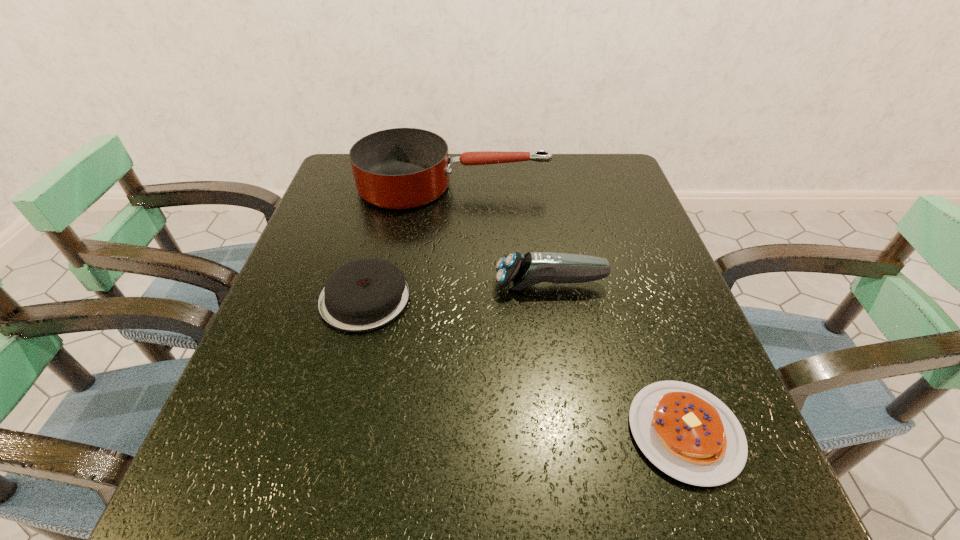
In order to click on object that is at the near right corner in this screenshot , I will do `click(688, 433)`.

The height and width of the screenshot is (540, 960). Find the location of `vacant space at the far edge of the desktop`. vacant space at the far edge of the desktop is located at coordinates (440, 199).

This screenshot has width=960, height=540. Identify the location of vacant space at the near edge of the desktop. (500, 476).

This screenshot has height=540, width=960. In the image, there is a desktop. In order to click on blank space at the left edge in this screenshot , I will do `click(342, 345)`.

You are a GUI agent. You are given a task and a screenshot of the screen. Output one action in this format:
    pyautogui.click(x=<x>, y=<y>)
    Task: Click on the vacant region at the right edge
    The image size is (960, 540).
    Given the screenshot: What is the action you would take?
    pyautogui.click(x=579, y=201)

The width and height of the screenshot is (960, 540). I want to click on vacant region at the far left corner of the desktop, so click(x=354, y=183).

Locate an element on the screen. This screenshot has width=960, height=540. free area in between the tallest object and the electric shaver is located at coordinates (502, 235).

Identify the location of blank region between the pan and the taller pancake. (409, 242).

Locate an element on the screen. free space between the second tallest object and the shortest object is located at coordinates tap(617, 358).

Locate an element on the screen. The height and width of the screenshot is (540, 960). unoccupied position between the left pancake and the nearer pancake is located at coordinates (525, 365).